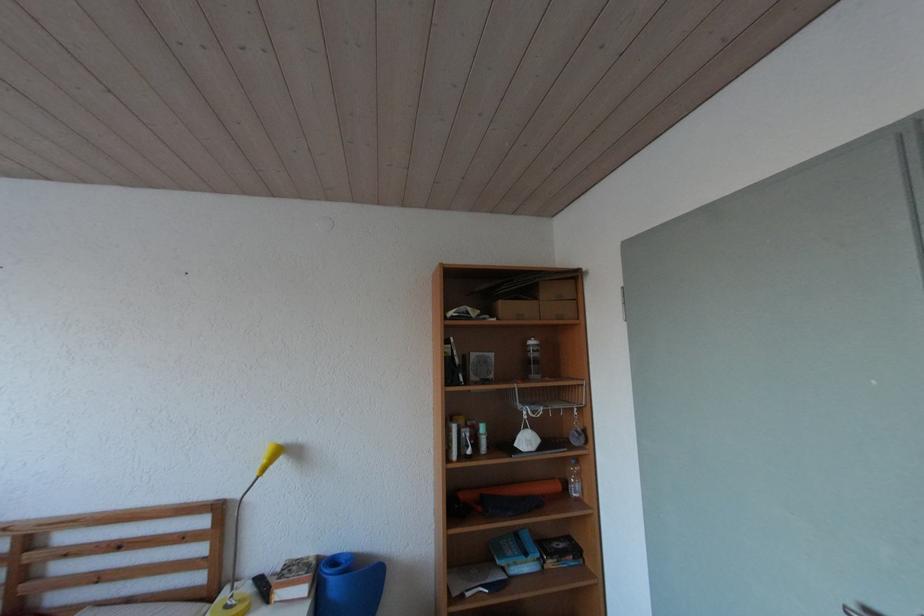
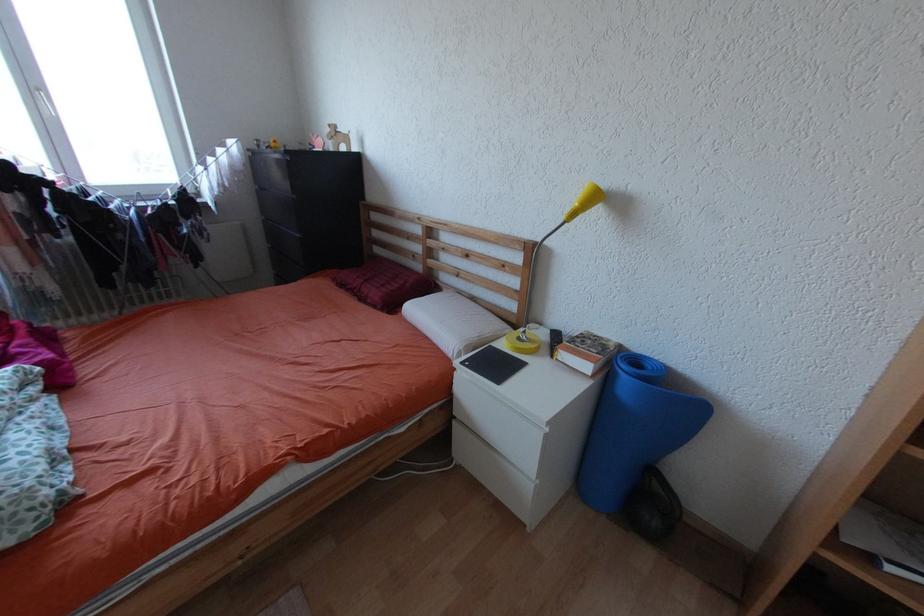
First-person continuous shooting, in which direction is the camera rotating?

The rotation direction of the camera is left-down.